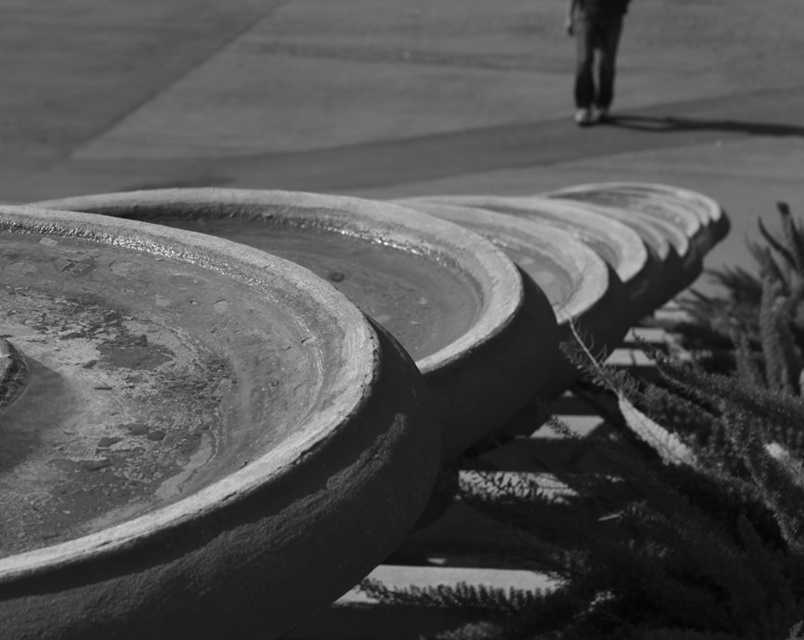
Identify the location of fuzzy green plant at center. This screenshot has width=804, height=640. (663, 490).

Between fuzzy green plant at center and dark jeans at upper right, which one has more height?

Standing taller between the two is fuzzy green plant at center.

Find the location of a particular element. fuzzy green plant at center is located at coordinates (663, 490).

This screenshot has height=640, width=804. Find the location of `fuzzy green plant at center`. fuzzy green plant at center is located at coordinates point(663,490).